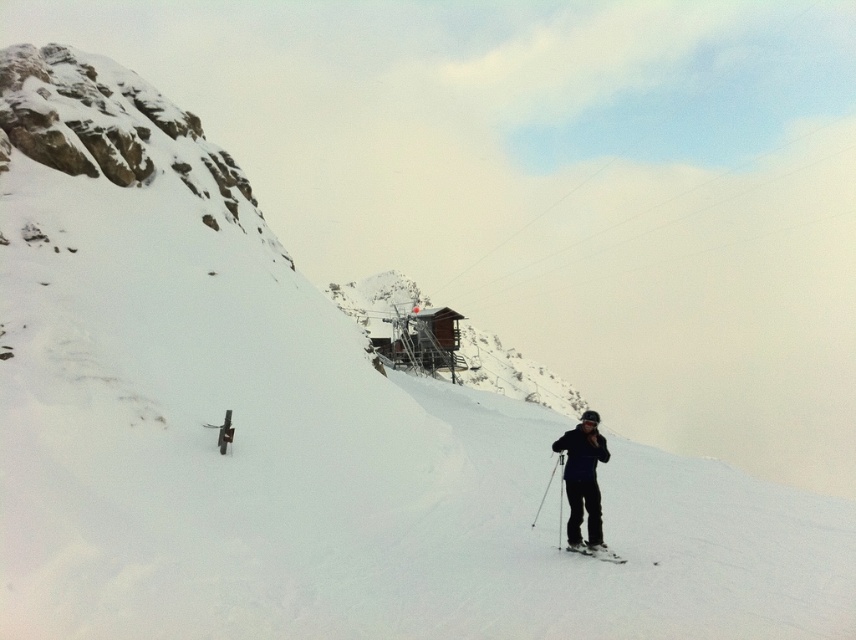
You are a photographer standing at the bottom of the slope. You want to take a photo of the matte black ski suit at lower right and the white matte ski at lower right. Which object will appear larger in the photo?

The matte black ski suit at lower right will appear larger in the photo because it is much taller than the white matte ski at lower right.

You are a skier standing at the point marked as point (587, 433) in the image. You want to reach the cabin near the center of the slope. Considering the distance between your current position and the cabin, can you estimate how long it would take you to ski down to the cabin if you maintain an average speed of 15 meters per minute?

The distance between point (587, 433) and the viewer is 40.40 meters. Assuming the cabin is near the center of the slope, the time to reach it at 15 meters per minute would be approximately 2.7 minutes.

You are a photographer positioned at the bottom of the slope. You want to capture a photo of the ski lift cables in the middle ground while ensuring both the matte black ski suit at lower right and the white matte ski at lower right are visible in the frame. Which object should you position closer to the left edge of your camera viewfinder to include both in the shot?

The white matte ski at lower right should be positioned closer to the left edge of the camera viewfinder because the matte black ski suit at lower right is to the right of the white matte ski at lower right. This arrangement will ensure both objects are within the frame while capturing the ski lift cables in the middle ground.